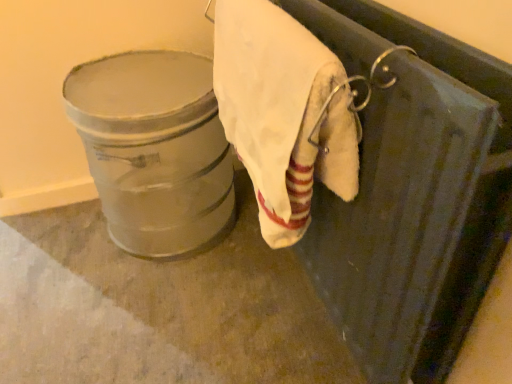
Image resolution: width=512 pixels, height=384 pixels. I want to click on vacant area that is in front of metallic silver bucket at left, so click(155, 318).